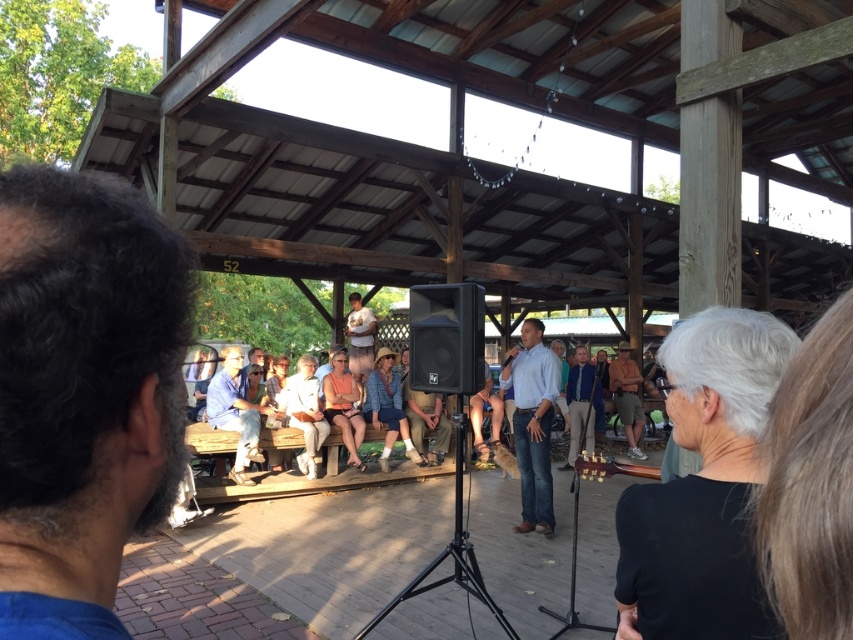
Based on the scene description, where is the black matte speaker at center located in the image?

The black matte speaker at center is located at point [445,339] in the image.